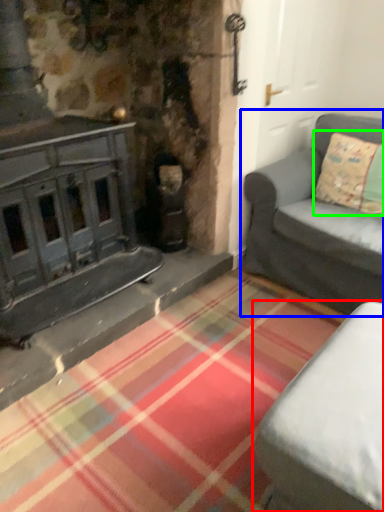
Question: Based on their relative distances, which object is farther from studio couch (highlighted by a red box)? Choose from studio couch (highlighted by a blue box) and pillow (highlighted by a green box).

Choices:
 (A) studio couch
 (B) pillow

Answer: (B)